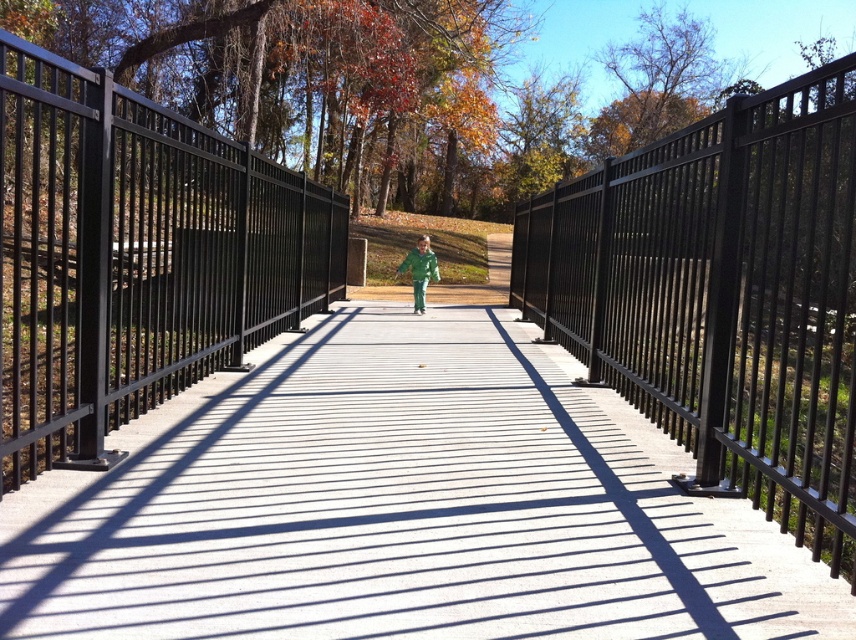
You are standing at the start of the smooth concrete path at center and want to reach the green matte jacket at center. Which direction should you walk to move towards it?

The smooth concrete path at center is on the right side of the green matte jacket at center, so you should walk to your left to move towards the green matte jacket at center.

You are standing at the starting point of the pathway and want to walk towards the end of the pathway. Which direction should you walk to avoid the black metal fence at left?

The black metal fence at left is located at the left side of the pathway. To avoid it, you should walk towards the right side of the pathway.